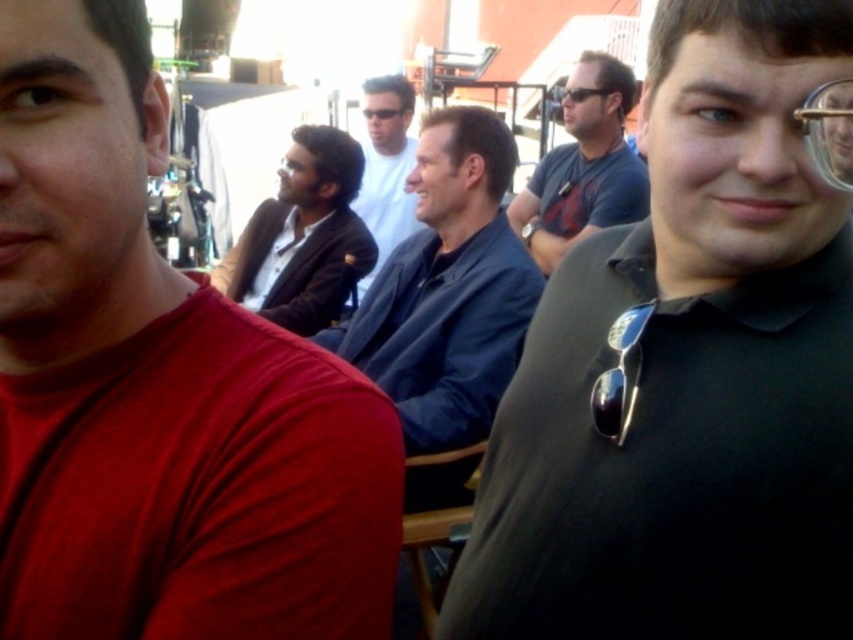
You are a photographer trying to capture a candid shot of the sunglasses at right and the white matte shirt at center. Which subject should you focus on first to ensure both are in frame without moving the camera?

The white matte shirt at center is closer to the viewer than the sunglasses at right, so focusing on the white matte shirt at center first will ensure both subjects remain in frame without needing to adjust the camera position.

You are a photographer at this event and want to capture a photo that includes both the white matte shirt at center and the sunglasses at right. Which object should you place on the left side of your frame to ensure both are visible?

The white matte shirt at center should be placed on the left side of your frame because it is already positioned on the left side of the sunglasses at right, ensuring both are visible.